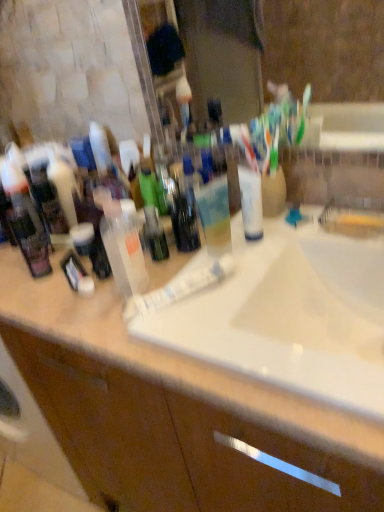
Where is `vacant space in front of white glossy tube at center`? The width and height of the screenshot is (384, 512). vacant space in front of white glossy tube at center is located at coordinates (223, 352).